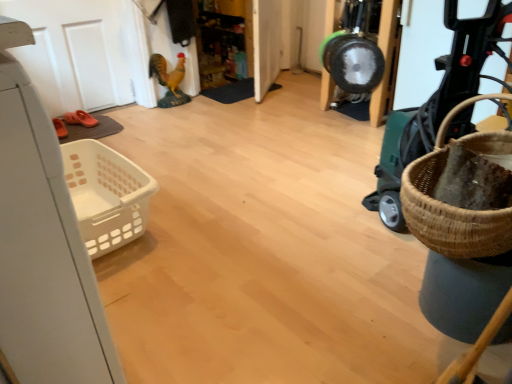
Locate an element on the screen. vacant space situated on the left part of shiny plastic rooster at upper center is located at coordinates (139, 110).